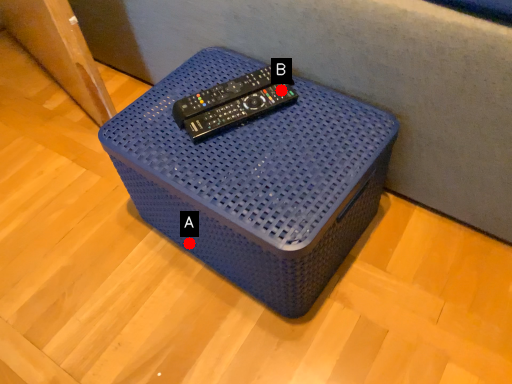
Question: Two points are circled on the image, labeled by A and B beside each circle. Which of the following is the farthest from the observer?

Choices:
 (A) A is further
 (B) B is further

Answer: (A)